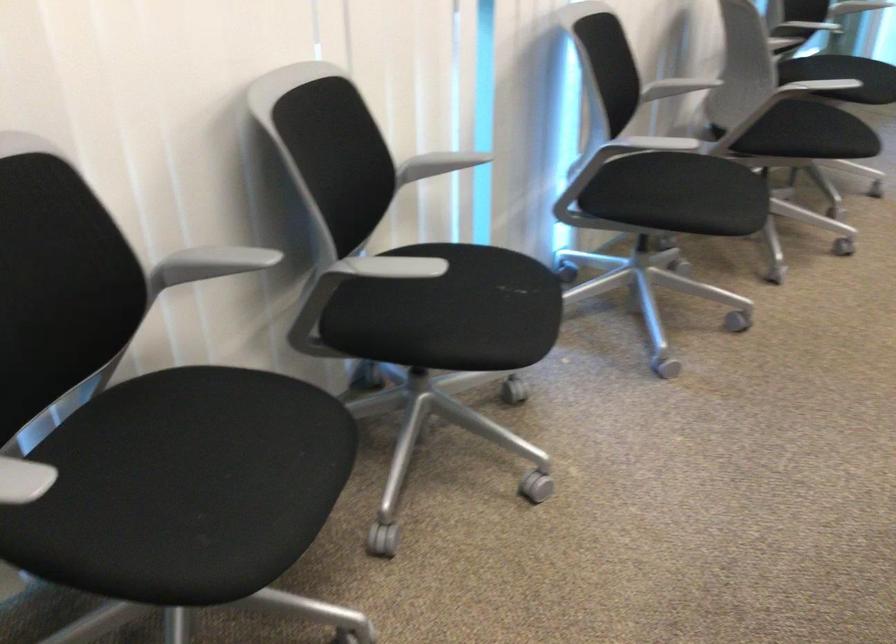
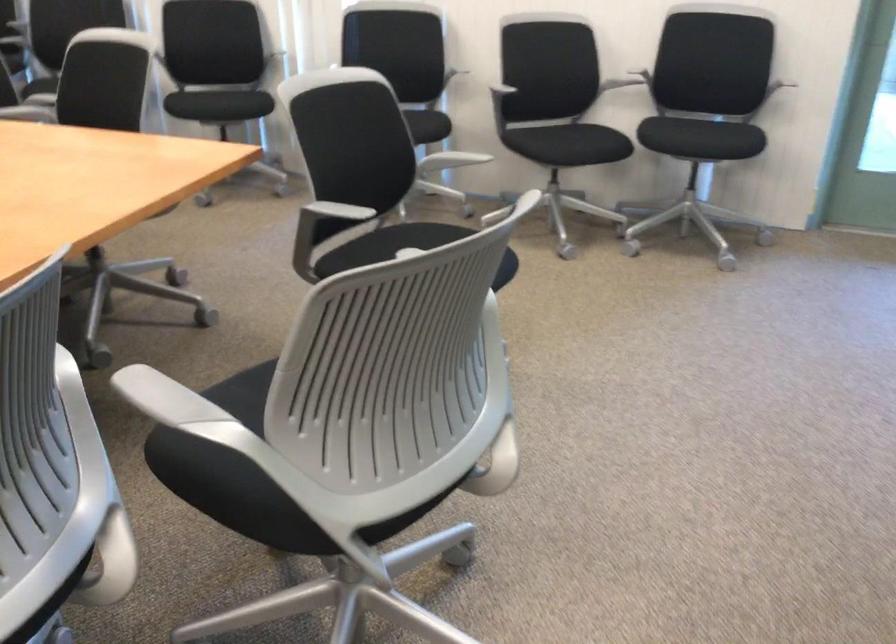
Where in the second image is the point corresponding to [718,104] from the first image?

(510, 96)